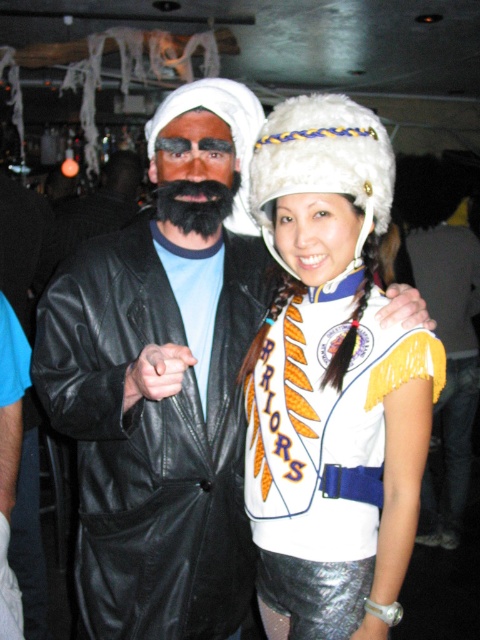
Question: Does white fur hat at upper center have a smaller size compared to white fuzzy hat at center?

Choices:
 (A) no
 (B) yes

Answer: (A)

Question: Observing the image, what is the correct spatial positioning of black leather coat at left in reference to white fuzzy hat at center?

Choices:
 (A) left
 (B) right

Answer: (A)

Question: Does white fur hat at upper center have a greater width compared to black fuzzy beard at center?

Choices:
 (A) yes
 (B) no

Answer: (A)

Question: Which point appears farthest from the camera in this image?

Choices:
 (A) (416, 348)
 (B) (160, 634)
 (C) (252, 132)

Answer: (C)

Question: Which object is closer to the camera taking this photo?

Choices:
 (A) black leather coat at left
 (B) white fur hat at upper center
 (C) white fuzzy hat at center

Answer: (A)

Question: Which of the following is the closest to the observer?

Choices:
 (A) white fur hat at upper center
 (B) white fuzzy hat at center
 (C) black leather coat at left
 (D) black fuzzy beard at center

Answer: (C)